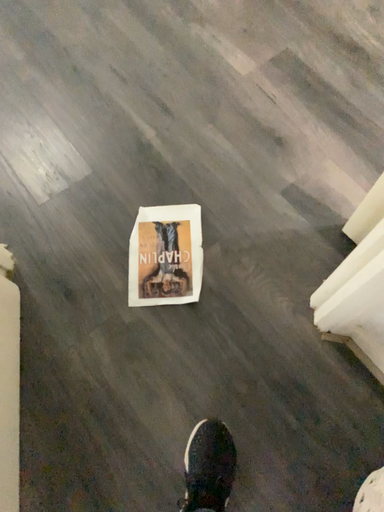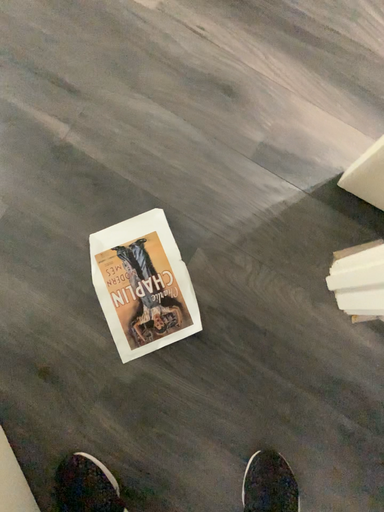
Question: How did the camera likely rotate when shooting the video?

Choices:
 (A) rotated upward
 (B) rotated downward

Answer: (B)